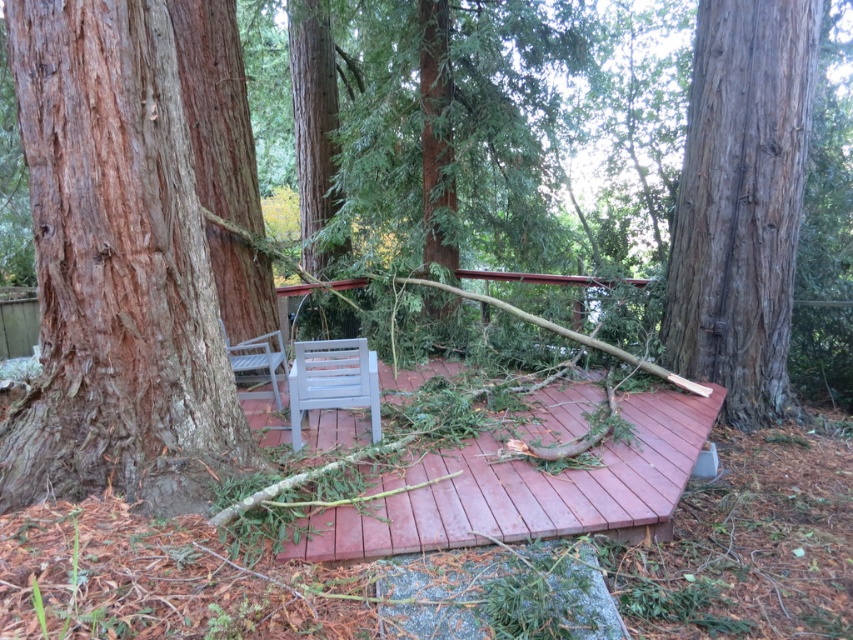
Does smooth reddish-brown tree trunk at center-left have a smaller size compared to white plastic chair at center?

No, smooth reddish-brown tree trunk at center-left is not smaller than white plastic chair at center.

Does smooth reddish-brown tree trunk at center-left appear on the left side of white plastic chair at center?

Yes, smooth reddish-brown tree trunk at center-left is to the left of white plastic chair at center.

Who is more distant from viewer, (193,202) or (323,387)?

Positioned behind is point (323,387).

Find the location of `smooth reddish-brown tree trunk at center-left`. smooth reddish-brown tree trunk at center-left is located at coordinates (115, 269).

Looking at this image, is smooth brown tree trunk at right taller than brown wood deck at center?

Indeed, smooth brown tree trunk at right has a greater height compared to brown wood deck at center.

Does point (807, 131) come closer to viewer compared to point (465, 525)?

No, it is not.

Who is more forward, (712,250) or (282,436)?

Point (282,436)

Locate an element on the screen. Image resolution: width=853 pixels, height=640 pixels. smooth brown tree trunk at right is located at coordinates (741, 202).

Who is taller, brown wood deck at center or white plastic chair at center?

Standing taller between the two is white plastic chair at center.

Is point (477, 492) positioned before point (364, 365)?

Yes, point (477, 492) is closer to viewer.

Does point (663, 460) come in front of point (375, 369)?

Yes, point (663, 460) is closer to viewer.

Where is `brown wood deck at center`? The image size is (853, 640). brown wood deck at center is located at coordinates (527, 490).